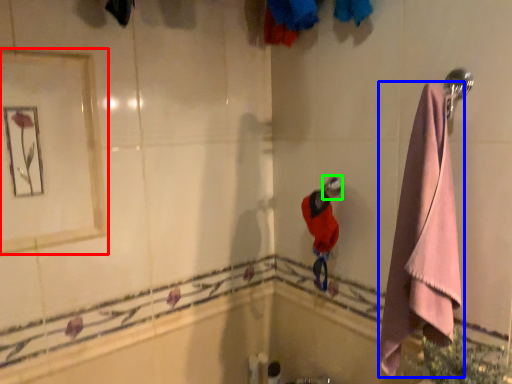
Question: Considering the real-world distances, which object is farthest from mirror (highlighted by a red box)? towel (highlighted by a blue box) or shower (highlighted by a green box)?

Choices:
 (A) towel
 (B) shower

Answer: (A)